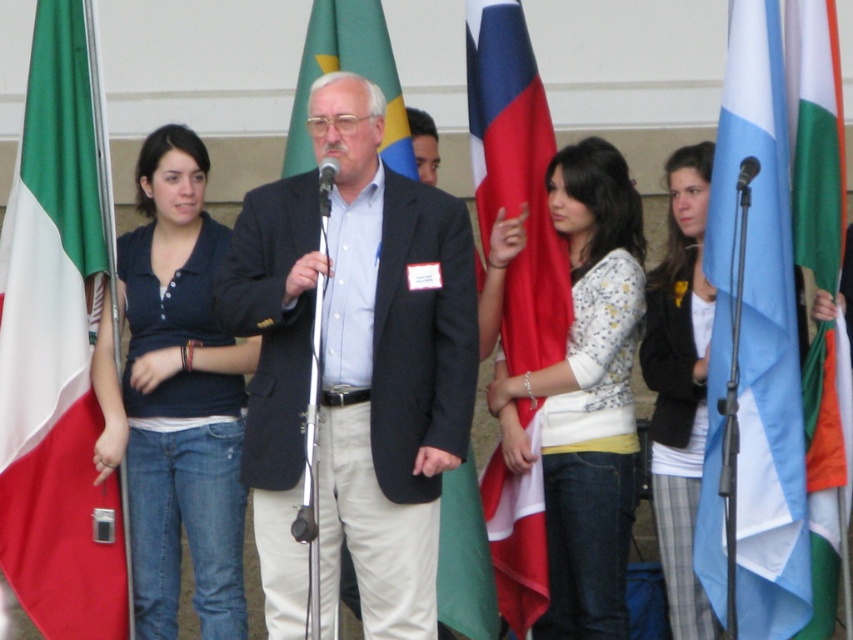
Does dark gray suit at center come in front of green fabric flag at center?

Yes, it is.

Which is below, dark gray suit at center or green fabric flag at center?

dark gray suit at center

Where is `dark gray suit at center`? The height and width of the screenshot is (640, 853). dark gray suit at center is located at coordinates (465, 561).

At what (x,y) coordinates should I click in order to perform the action: click on dark gray suit at center. Please return your answer as a coordinate pair (x, y). The image size is (853, 640). Looking at the image, I should click on (465, 561).

Is matte black shirt at center wider than metallic silver microphone at center?

Correct, the width of matte black shirt at center exceeds that of metallic silver microphone at center.

Who is taller, matte black shirt at center or metallic silver microphone at center?

Standing taller between the two is matte black shirt at center.

Where is `matte black shirt at center`? matte black shirt at center is located at coordinates (177, 397).

Where is `blue/white fabric flag at right`? This screenshot has width=853, height=640. blue/white fabric flag at right is located at coordinates (753, 348).